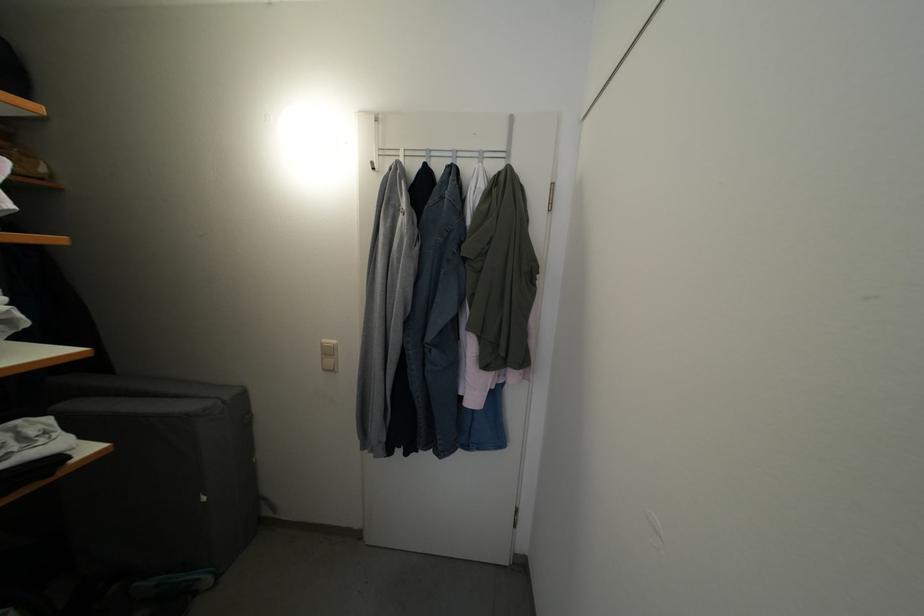
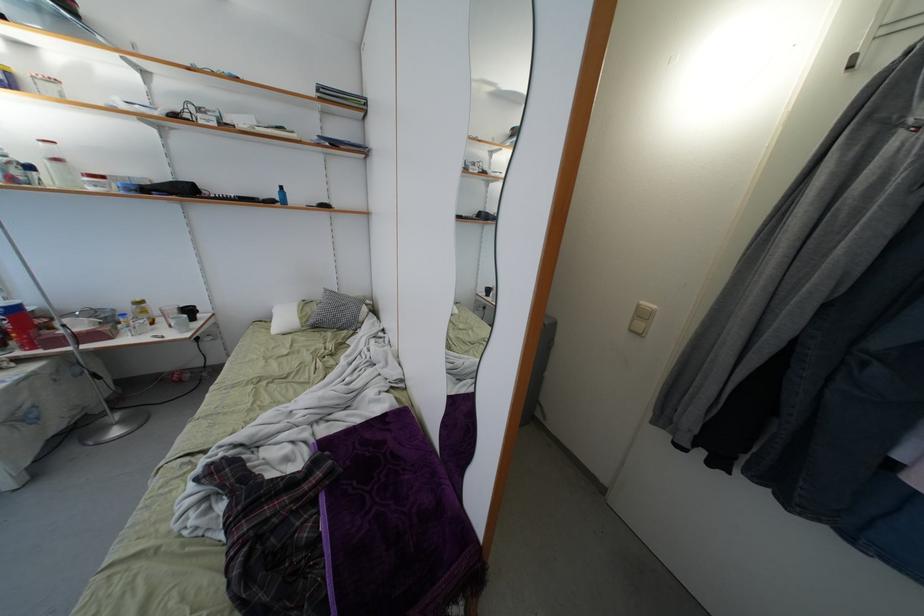
Question: The first image is from the beginning of the video and the second image is from the end. How did the camera likely rotate when shooting the video?

Choices:
 (A) Left
 (B) Right
 (C) Up
 (D) Down

Answer: (A)